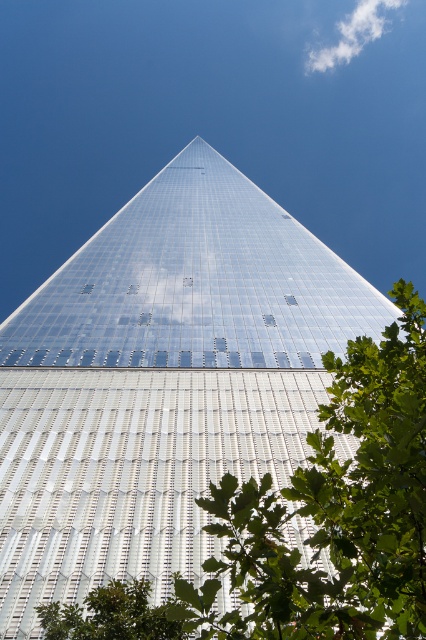
You are standing in front of the skyscraper and notice a point marked at coordinates (112, 616). Based on the scene description, what object does this point most likely represent?

The point at coordinates (112, 616) corresponds to the green leafy tree at lower center.

You are a drone operator trying to capture a photo of the skyscraper. You notice the green leafy tree at center and the white fluffy cloud at upper center. Which object is closer to the camera based on their positions?

The green leafy tree at center is closer to the camera than the white fluffy cloud at upper center because it is shorter and positioned in the foreground, while the cloud is higher and in the background.

You are standing at the base of the skyscraper and want to take a photo of the point marked at coordinates point (x=376, y=387). If your camera has a maximum zoom range of 5 meters, will you be able to capture the point clearly?

The point marked at coordinates point (x=376, y=387) is 5.34 meters away from the camera. Since the camera can only zoom up to 5 meters, it will not be able to capture the point clearly.